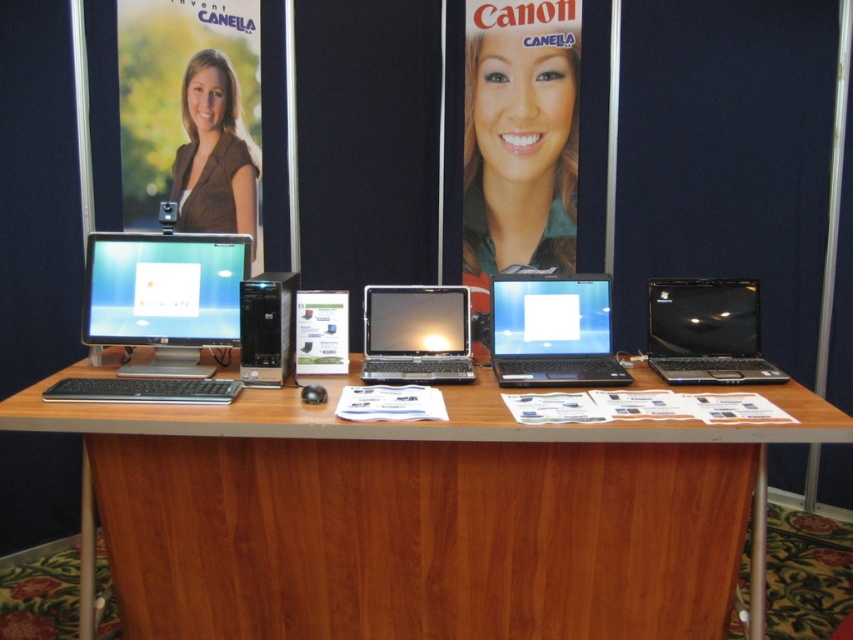
Who is more forward, (143, 284) or (277, 380)?

Point (277, 380)

Does point (189, 355) come farther from viewer compared to point (254, 344)?

Yes, it is.

The width and height of the screenshot is (853, 640). In order to click on matte black monitor at center in this screenshot , I will do `click(164, 298)`.

Image resolution: width=853 pixels, height=640 pixels. What do you see at coordinates (190, 113) in the screenshot? I see `brown fabric poster at upper left` at bounding box center [190, 113].

Measure the distance between brown fabric poster at upper left and matte black laptop at center.

1.42 meters

This screenshot has height=640, width=853. In order to click on brown fabric poster at upper left in this screenshot , I will do `click(190, 113)`.

Who is more forward, (x=234, y=211) or (x=86, y=282)?

Positioned in front is point (x=86, y=282).

In the scene shown: Who is shorter, brown fabric poster at upper left or matte black monitor at center?

Standing shorter between the two is matte black monitor at center.

Where is `brown fabric poster at upper left`? brown fabric poster at upper left is located at coordinates (190, 113).